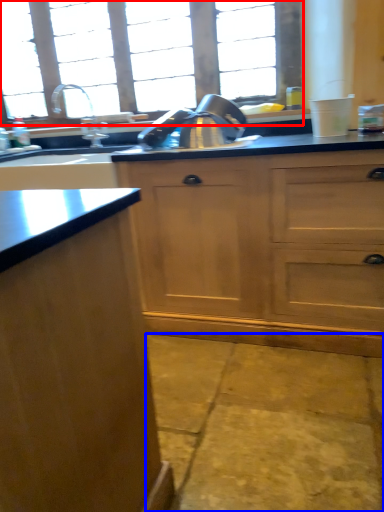
Question: Which object is closer to the camera taking this photo, window (highlighted by a red box) or concrete (highlighted by a blue box)?

Choices:
 (A) window
 (B) concrete

Answer: (B)